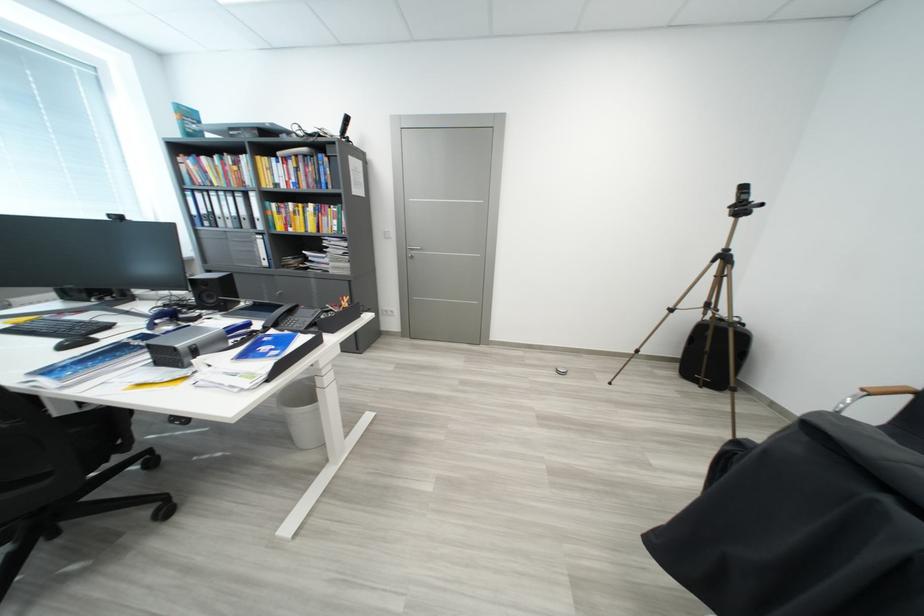
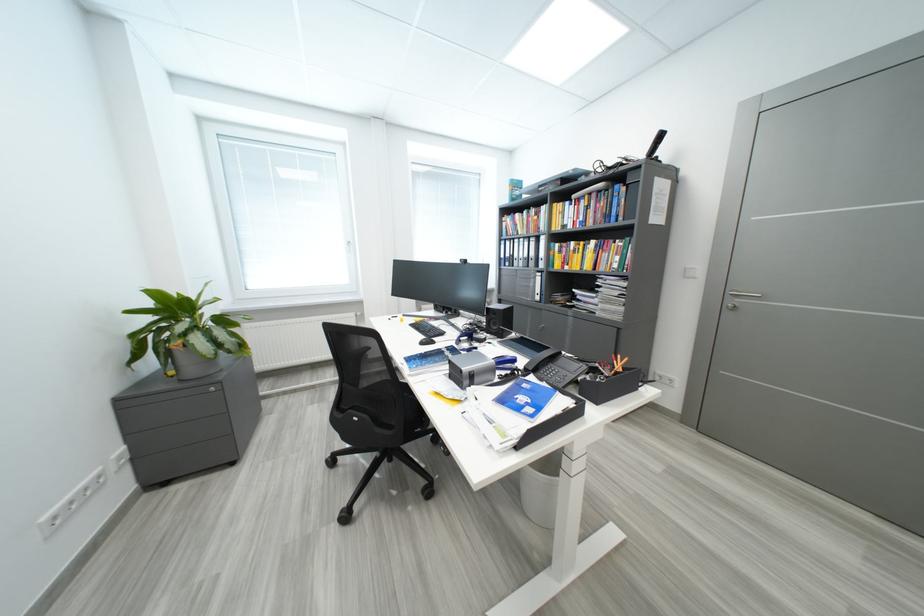
The point at [204,355] is marked in the first image. Where is the corresponding point in the second image?

(481, 381)